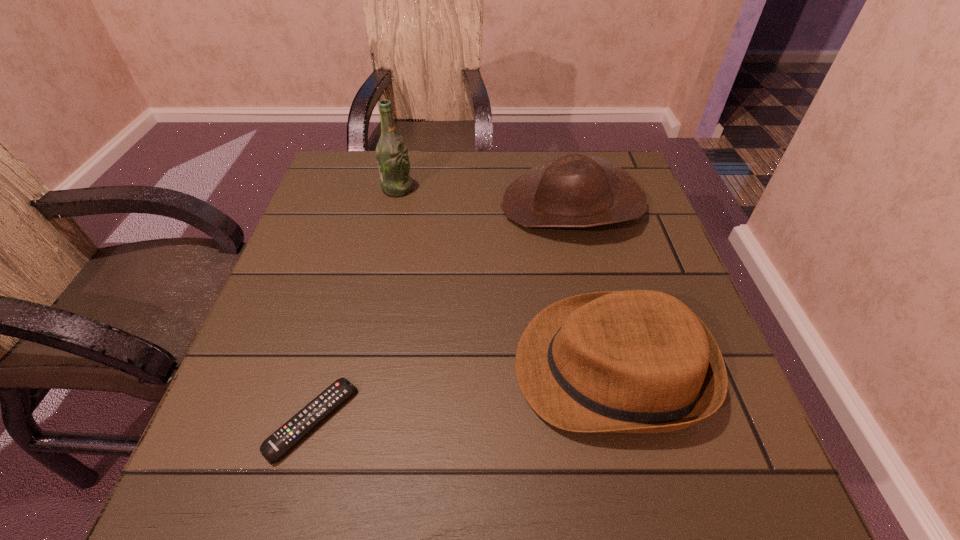
Where is `beer bottle`? The height and width of the screenshot is (540, 960). beer bottle is located at coordinates (392, 157).

Where is `cowboy hat`? cowboy hat is located at coordinates (573, 191).

This screenshot has width=960, height=540. Find the location of `fedora`. fedora is located at coordinates (636, 361).

Locate an element on the screen. the shortest object is located at coordinates (277, 444).

Identify the location of vacant area situated on the surface of the tallest object. This screenshot has height=540, width=960. (509, 188).

Where is `free spot located on the left of the cowboy hat`? This screenshot has height=540, width=960. free spot located on the left of the cowboy hat is located at coordinates (451, 206).

Where is `vacant region located on the front-facing side of the fedora`? vacant region located on the front-facing side of the fedora is located at coordinates (462, 368).

This screenshot has height=540, width=960. I want to click on vacant space located 0.330m on the front-facing side of the fedora, so [320, 368].

Where is `free space located 0.100m on the front-facing side of the fedora`? Image resolution: width=960 pixels, height=540 pixels. free space located 0.100m on the front-facing side of the fedora is located at coordinates (456, 368).

Identify the location of free spot located on the back of the remote control. The image size is (960, 540). (358, 256).